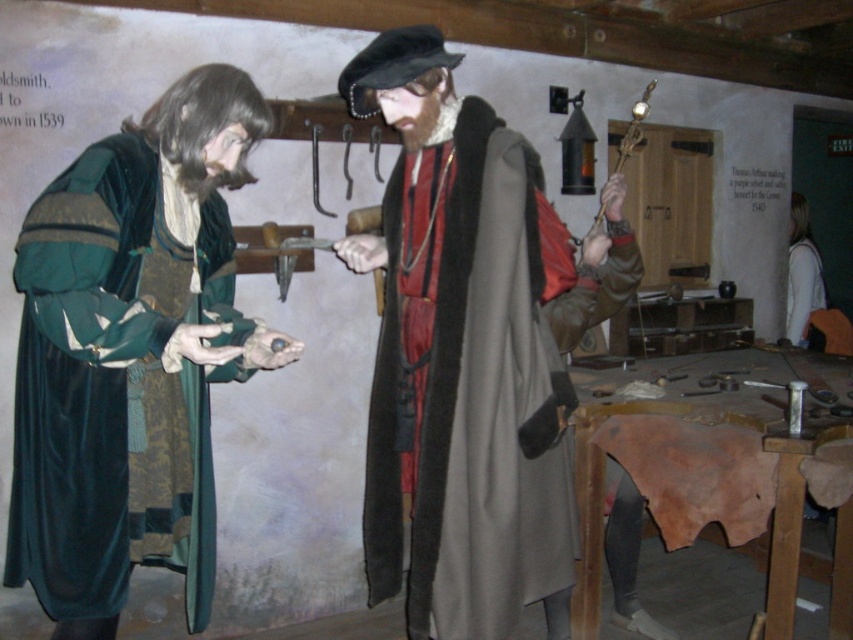
Question: Does dark gray woolen cloak at center appear on the right side of white fabric shirt at right?

Choices:
 (A) no
 (B) yes

Answer: (A)

Question: Which of these objects is positioned farthest from the white fabric shirt at right?

Choices:
 (A) dark gray woolen cloak at center
 (B) velvet green robe at left

Answer: (B)

Question: In this image, where is dark gray woolen cloak at center located relative to white fabric shirt at right?

Choices:
 (A) above
 (B) below

Answer: (B)

Question: Which object is farther from the camera taking this photo?

Choices:
 (A) velvet green robe at left
 (B) dark gray woolen cloak at center

Answer: (B)

Question: Can you confirm if dark gray woolen cloak at center is positioned above white fabric shirt at right?

Choices:
 (A) no
 (B) yes

Answer: (A)

Question: Which point appears farthest from the camera in this image?

Choices:
 (A) (804, 266)
 (B) (479, 164)
 (C) (219, 77)

Answer: (A)